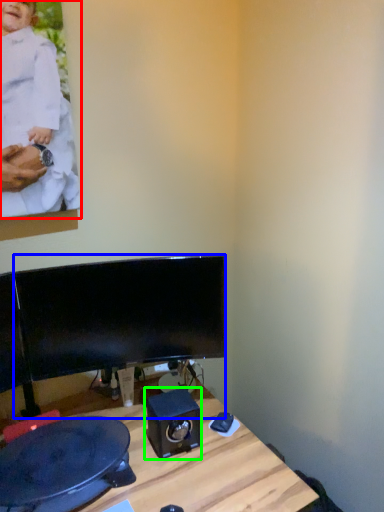
Question: Which object is the farthest from person (highlighted by a red box)? Choose among these: computer monitor (highlighted by a blue box) or speaker (highlighted by a green box).

Choices:
 (A) computer monitor
 (B) speaker

Answer: (B)